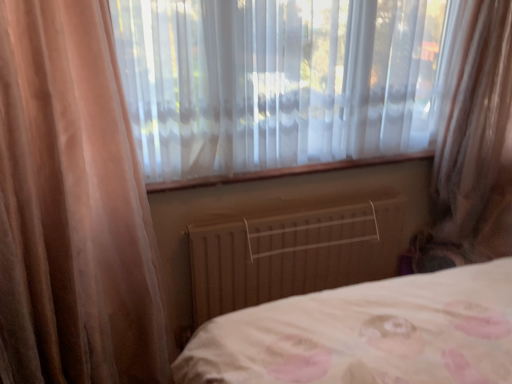
Measure the distance between point [275,243] and camera.

Point [275,243] is 6.38 feet away from camera.

What are the coordinates of `translucent fabric curtain at right` in the screenshot? It's located at (473, 142).

Considering the relative sizes of wooden radiator at center and translucent fabric at center in the image provided, is wooden radiator at center thinner than translucent fabric at center?

Yes, wooden radiator at center is thinner than translucent fabric at center.

Is wooden radiator at center beside translucent fabric at center?

No, wooden radiator at center is not beside translucent fabric at center.

In the scene shown: How many degrees apart are the facing directions of wooden radiator at center and translucent fabric at center?

They differ by 0.761 degrees in their facing directions.

In the image, there is a translucent fabric at center. Where is `radiator below it (from the image's perspective)`? This screenshot has width=512, height=384. radiator below it (from the image's perspective) is located at coordinates (292, 254).

Is wooden radiator at center far from translucent fabric curtain at right?

That's not correct — wooden radiator at center is a little close to translucent fabric curtain at right.

From the image's perspective, which is below, wooden radiator at center or translucent fabric curtain at right?

wooden radiator at center, from the image's perspective.

Locate an element on the screen. The image size is (512, 384). radiator on the left of the translucent fabric curtain at right is located at coordinates (292, 254).

Can you tell me how much wooden radiator at center and translucent fabric curtain at right differ in facing direction?

47.8 degrees.

From a real-world perspective, which is physically above, translucent fabric at center or wooden radiator at center?

In real-world perspective, translucent fabric at center is above.

Is translucent fabric at center touching wooden radiator at center?

No, translucent fabric at center is not beside wooden radiator at center.

Considering the sizes of objects translucent fabric at center and wooden radiator at center in the image provided, who is wider, translucent fabric at center or wooden radiator at center?

With larger width is translucent fabric at center.

Can you tell me how much translucent fabric at center and wooden radiator at center differ in facing direction?

The angular difference between translucent fabric at center and wooden radiator at center is 0.761 degrees.

Identify the location of radiator below the translucent fabric curtain at right (from a real-world perspective). This screenshot has width=512, height=384. [292, 254].

Considering the positions of objects translucent fabric curtain at right and wooden radiator at center in the image provided, who is behind, translucent fabric curtain at right or wooden radiator at center?

wooden radiator at center is behind.

In terms of width, does translucent fabric curtain at right look wider or thinner when compared to wooden radiator at center?

Clearly, translucent fabric curtain at right has more width compared to wooden radiator at center.

Considering the sizes of translucent fabric curtain at right and wooden radiator at center in the image, is translucent fabric curtain at right bigger or smaller than wooden radiator at center?

In the image, translucent fabric curtain at right appears to be larger than wooden radiator at center.

Considering the sizes of objects translucent fabric at center and translucent fabric curtain at right in the image provided, who is taller, translucent fabric at center or translucent fabric curtain at right?

translucent fabric curtain at right.

From the image's perspective, is translucent fabric at center located beneath translucent fabric curtain at right?

Incorrect, from the image's perspective, translucent fabric at center is higher than translucent fabric curtain at right.

Which is nearer, (138, 25) or (457, 58)?

Point (138, 25)

Is translucent fabric at center oriented away from translucent fabric curtain at right?

No, translucent fabric at center's orientation is not away from translucent fabric curtain at right.

Consider the image. Is translucent fabric curtain at right to the right of translucent fabric at center from the viewer's perspective?

Yes.

Find the location of a particular element. Image resolution: width=512 pixels, height=384 pixels. curtain that appears on the right of translucent fabric at center is located at coordinates (473, 142).

Does translucent fabric curtain at right touch translucent fabric at center?

translucent fabric curtain at right and translucent fabric at center are clearly separated.

The image size is (512, 384). Find the location of `window located in front of the wooden radiator at center`. window located in front of the wooden radiator at center is located at coordinates (277, 84).

At what (x,y) coordinates should I click in order to perform the action: click on curtain on the right side of wooden radiator at center. Please return your answer as a coordinate pair (x, y). This screenshot has width=512, height=384. Looking at the image, I should click on (473, 142).

Estimate the real-world distances between objects in this image. Which object is closer to translucent fabric at center, translucent fabric curtain at right or wooden radiator at center?

Based on the image, wooden radiator at center appears to be nearer to translucent fabric at center.

When comparing their distances from translucent fabric at center, does wooden radiator at center or translucent fabric curtain at right seem closer?

wooden radiator at center lies closer to translucent fabric at center than the other object.

Looking at the image, which one is located further to translucent fabric curtain at right, wooden radiator at center or translucent fabric at center?

Among the two, wooden radiator at center is located further to translucent fabric curtain at right.

Considering their positions, is translucent fabric at center positioned closer to translucent fabric curtain at right than wooden radiator at center?

translucent fabric at center lies closer to translucent fabric curtain at right than the other object.

From the image, which object appears to be nearer to wooden radiator at center, translucent fabric curtain at right or translucent fabric at center?

translucent fabric at center.

Considering their positions, is translucent fabric at center positioned further to wooden radiator at center than translucent fabric curtain at right?

The object further to wooden radiator at center is translucent fabric curtain at right.

I want to click on radiator between translucent fabric at center and translucent fabric curtain at right, so click(292, 254).